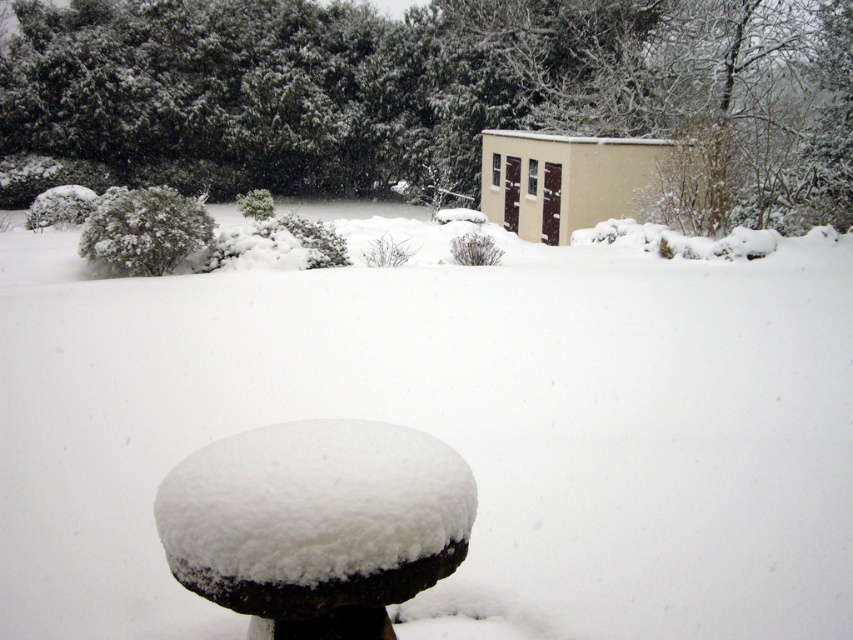
Looking at this image, is white fluffy snow at center further to camera compared to beige matte shed at upper center?

No, it is not.

Can you confirm if white fluffy snow at center is thinner than beige matte shed at upper center?

In fact, white fluffy snow at center might be wider than beige matte shed at upper center.

Who is more distant from viewer, (144, 422) or (624, 145)?

Positioned behind is point (624, 145).

Find the location of a particular element. The height and width of the screenshot is (640, 853). white fluffy snow at center is located at coordinates (451, 428).

Is white fluffy snow at center taller than green leafy tree at upper center?

In fact, white fluffy snow at center may be shorter than green leafy tree at upper center.

What do you see at coordinates (451, 428) in the screenshot? I see `white fluffy snow at center` at bounding box center [451, 428].

Who is more forward, [618,470] or [83,12]?

Point [618,470] is more forward.

The width and height of the screenshot is (853, 640). I want to click on white fluffy snow at center, so (x=451, y=428).

Which is below, green leafy tree at upper center or white snow-covered stool at center?

white snow-covered stool at center is below.

The width and height of the screenshot is (853, 640). What do you see at coordinates (440, 93) in the screenshot?
I see `green leafy tree at upper center` at bounding box center [440, 93].

Locate an element on the screen. The image size is (853, 640). green leafy tree at upper center is located at coordinates (440, 93).